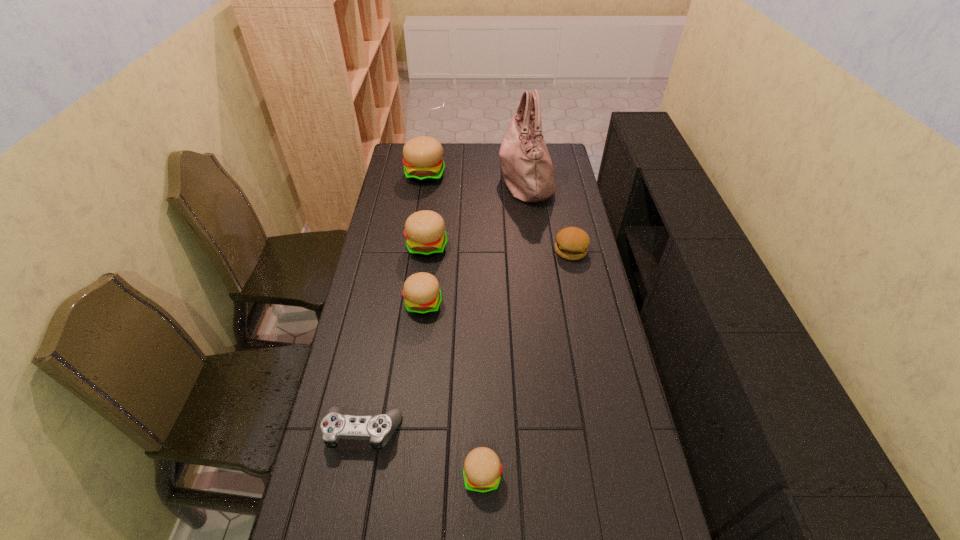
Where is `handbag`? The height and width of the screenshot is (540, 960). handbag is located at coordinates (527, 168).

Where is `the second tallest object`? This screenshot has height=540, width=960. the second tallest object is located at coordinates tap(423, 163).

The width and height of the screenshot is (960, 540). What are the coordinates of `the farthest beige hamburger` in the screenshot? It's located at (423, 163).

Find the location of `the second biggest beige hamburger`. the second biggest beige hamburger is located at coordinates (424, 230).

Locate an element on the screen. Image resolution: width=960 pixels, height=540 pixels. the second tallest hamburger is located at coordinates (424, 230).

You are a GUI agent. You are given a task and a screenshot of the screen. Output one action in this format:
    pyautogui.click(x=<x>, y=<y>)
    Task: Click on the fifth farthest object
    This screenshot has width=960, height=540.
    Given the screenshot: What is the action you would take?
    pyautogui.click(x=422, y=293)

This screenshot has width=960, height=540. In order to click on the third shortest hamburger in this screenshot , I will do `click(422, 293)`.

Find the location of a particular element. The width and height of the screenshot is (960, 540). the rightmost hamburger is located at coordinates (572, 243).

The height and width of the screenshot is (540, 960). I want to click on the fifth object from left to right, so click(482, 470).

Identify the location of the nearest hamburger. The height and width of the screenshot is (540, 960). (482, 470).